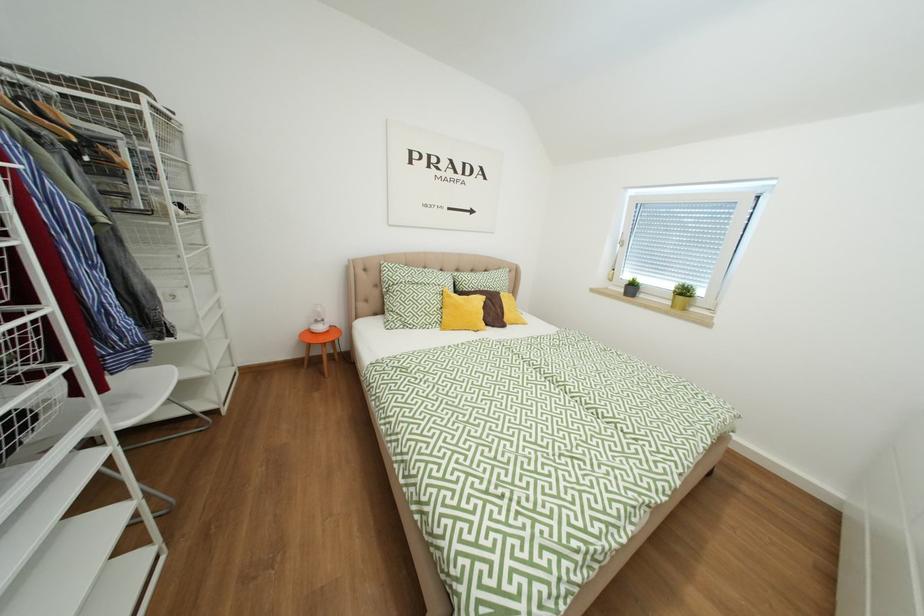
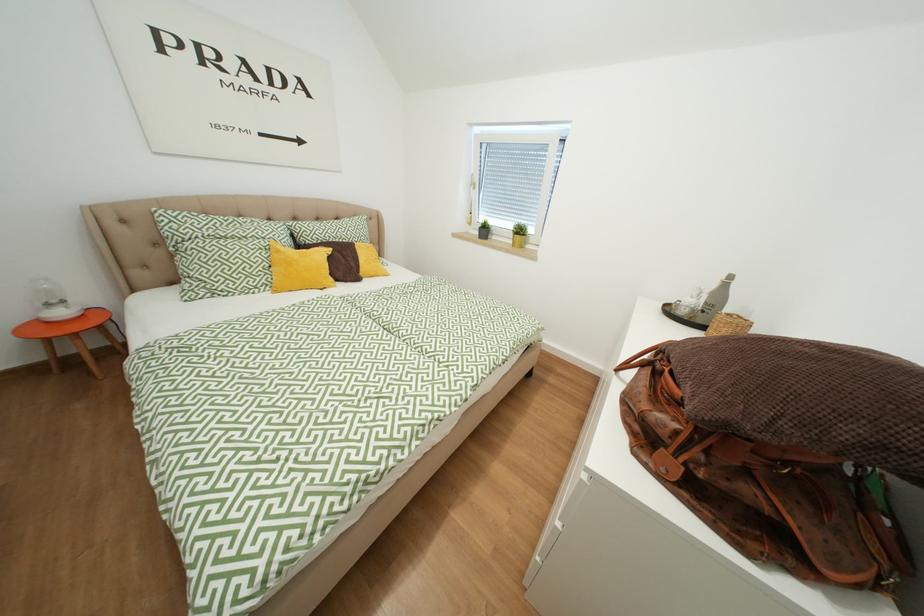
Question: The images are taken continuously from a first-person perspective. In which direction are you moving?

Choices:
 (A) Left
 (B) Right
 (C) Forward
 (D) Backward

Answer: (B)